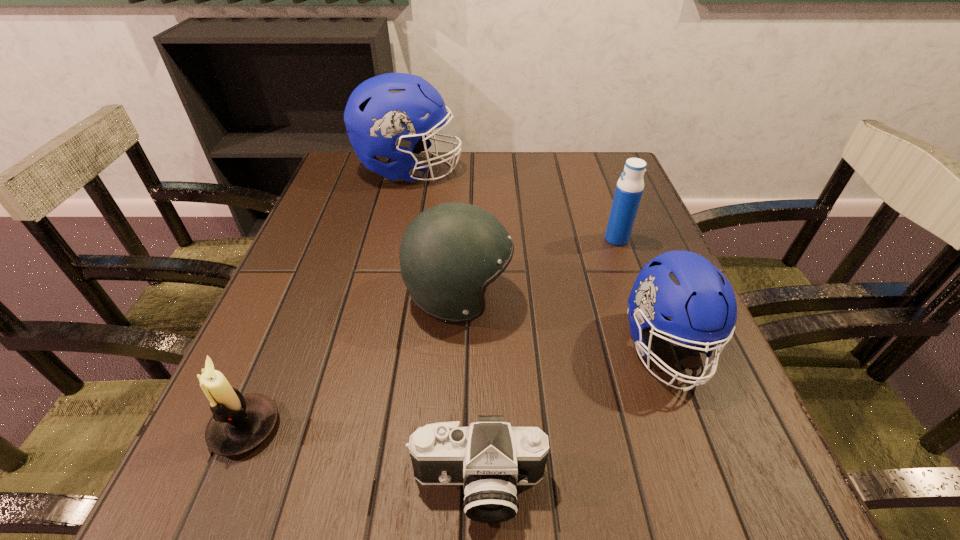
Where is `vacant area that lies between the tallest object and the rightmost football helmet`? The width and height of the screenshot is (960, 540). vacant area that lies between the tallest object and the rightmost football helmet is located at coordinates (539, 259).

Identify which object is the nearest to the second farthest object. Please provide its 2D coordinates. Your answer should be formatted as a tuple, i.e. [(x, y)], where the tuple contains the x and y coordinates of a point satisfying the conditions above.

[(682, 285)]

Where is `the second closest object to the camera`? The image size is (960, 540). the second closest object to the camera is located at coordinates (240, 423).

Locate which football helmet is the second closest to the rightmost football helmet. Please provide its 2D coordinates. Your answer should be formatted as a tuple, i.e. [(x, y)], where the tuple contains the x and y coordinates of a point satisfying the conditions above.

[(382, 116)]

The width and height of the screenshot is (960, 540). I want to click on the second closest football helmet to the candle holder, so click(682, 285).

This screenshot has height=540, width=960. What are the coordinates of `vacant area that satisfies the following two spatial constraints: 1. on the back side of the water bottle; 2. on the front-facing side of the tallest football helmet` in the screenshot? It's located at click(591, 170).

Where is `blank space that satisfies the following two spatial constraints: 1. on the back side of the fifth nearest object; 2. on the front-facing side of the farthest football helmet`? The height and width of the screenshot is (540, 960). blank space that satisfies the following two spatial constraints: 1. on the back side of the fifth nearest object; 2. on the front-facing side of the farthest football helmet is located at coordinates (591, 170).

Where is `vacant space that satisfies the following two spatial constraints: 1. on the front-facing side of the shortest object; 2. on the left side of the farthest object`? vacant space that satisfies the following two spatial constraints: 1. on the front-facing side of the shortest object; 2. on the left side of the farthest object is located at coordinates (336, 486).

Where is `free location that satisfies the following two spatial constraints: 1. on the front-facing side of the fifth nearest object; 2. on the left side of the farthest object`? free location that satisfies the following two spatial constraints: 1. on the front-facing side of the fifth nearest object; 2. on the left side of the farthest object is located at coordinates (394, 239).

Image resolution: width=960 pixels, height=540 pixels. Find the location of `blank area in the image that satisfies the following two spatial constraints: 1. on the front-facing side of the tallest football helmet; 2. on the front side of the candle holder`. blank area in the image that satisfies the following two spatial constraints: 1. on the front-facing side of the tallest football helmet; 2. on the front side of the candle holder is located at coordinates (349, 428).